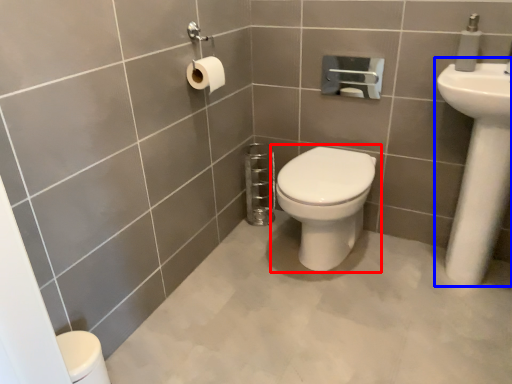
Question: Which object appears farthest to the camera in this image, toilet (highlighted by a red box) or sink (highlighted by a blue box)?

Choices:
 (A) toilet
 (B) sink

Answer: (A)